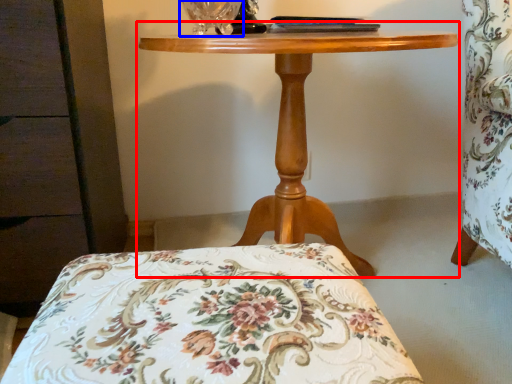
Question: Among these objects, which one is nearest to the camera, table (highlighted by a red box) or glass vase (highlighted by a blue box)?

Choices:
 (A) table
 (B) glass vase

Answer: (A)